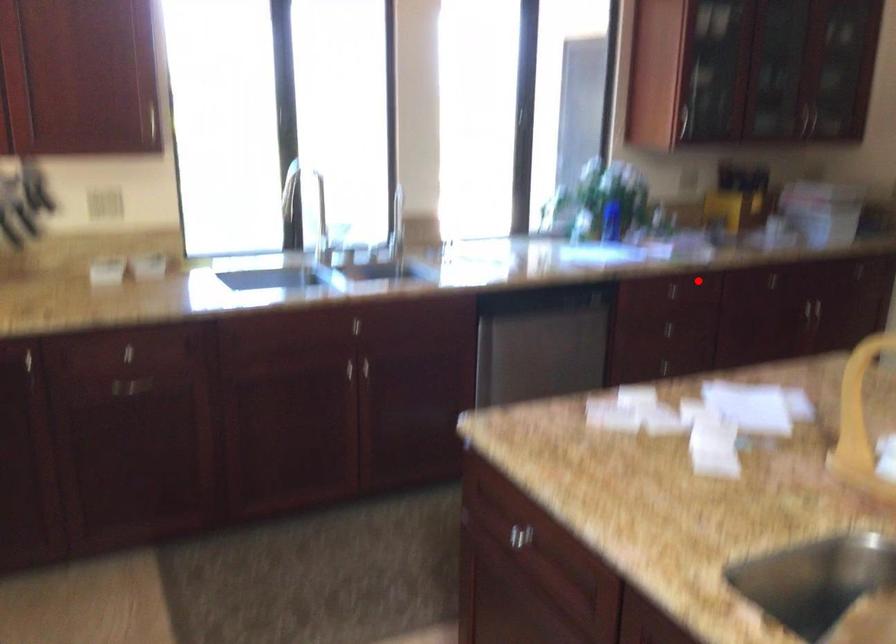
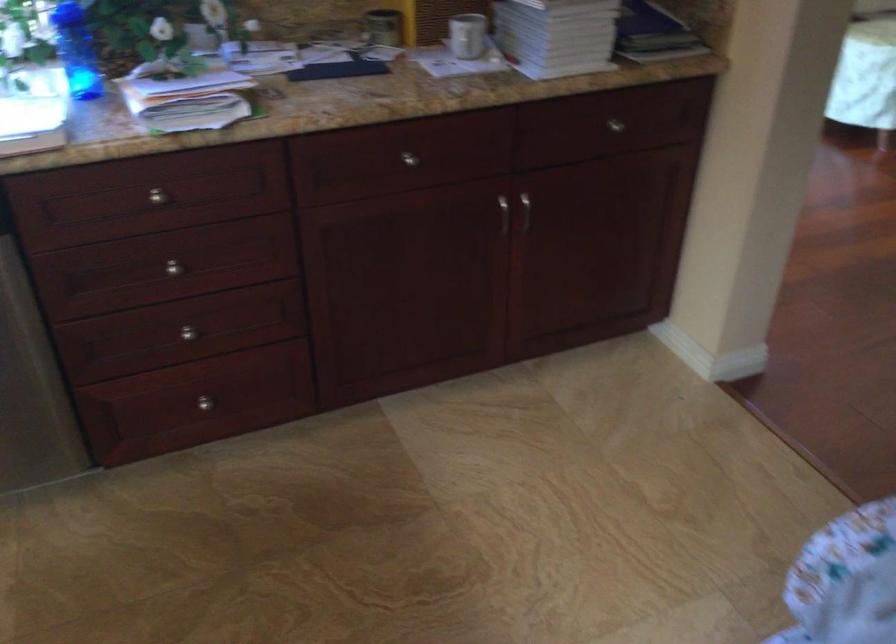
Question: A red point is marked in image1. In image2, is the corresponding 3D point closer to the camera or farther? Reply with the corresponding letter.

Choices:
 (A) The corresponding 3D point is closer.
 (B) The corresponding 3D point is farther.

Answer: (A)